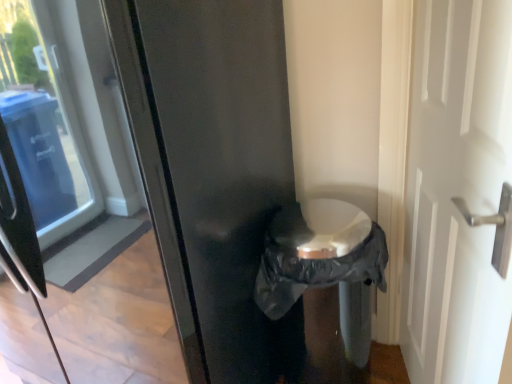
Question: From the image's perspective, is white glossy door at right over black plastic bag at center?

Choices:
 (A) yes
 (B) no

Answer: (A)

Question: Considering the relative sizes of white glossy door at right and black plastic bag at center in the image provided, is white glossy door at right bigger than black plastic bag at center?

Choices:
 (A) no
 (B) yes

Answer: (A)

Question: Does white glossy door at right have a smaller size compared to black plastic bag at center?

Choices:
 (A) no
 (B) yes

Answer: (B)

Question: Is white glossy door at right taller than black plastic bag at center?

Choices:
 (A) yes
 (B) no

Answer: (A)

Question: Is white glossy door at right looking in the opposite direction of black plastic bag at center?

Choices:
 (A) yes
 (B) no

Answer: (A)

Question: Can you confirm if white glossy door at right is shorter than black plastic bag at center?

Choices:
 (A) yes
 (B) no

Answer: (B)

Question: Would you say matte black refrigerator at center contains black plastic bag at center?

Choices:
 (A) no
 (B) yes

Answer: (A)

Question: Does matte black refrigerator at center have a larger size compared to black plastic bag at center?

Choices:
 (A) yes
 (B) no

Answer: (A)

Question: Is matte black refrigerator at center to the left of black plastic bag at center from the viewer's perspective?

Choices:
 (A) yes
 (B) no

Answer: (A)

Question: From the image's perspective, is matte black refrigerator at center located beneath black plastic bag at center?

Choices:
 (A) no
 (B) yes

Answer: (A)

Question: Can you confirm if matte black refrigerator at center is thinner than black plastic bag at center?

Choices:
 (A) no
 (B) yes

Answer: (A)

Question: From the image's perspective, is matte black refrigerator at center on top of black plastic bag at center?

Choices:
 (A) yes
 (B) no

Answer: (A)

Question: Is white glossy door at right located within black plastic bag at center?

Choices:
 (A) no
 (B) yes

Answer: (A)